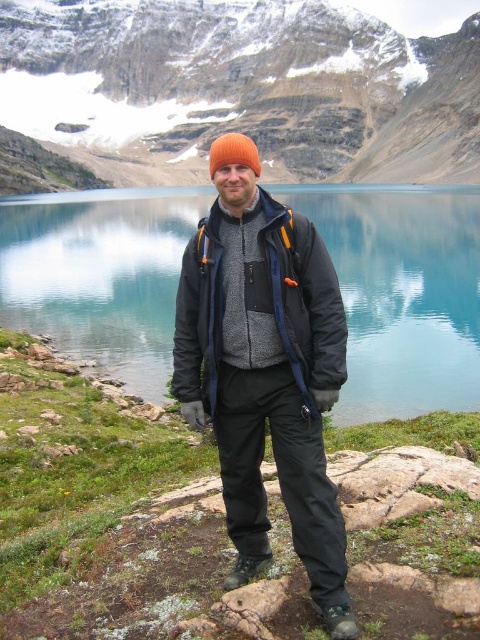
You are a hiker trying to identify your friend who is wearing two jackets. You see a matte black jacket at center and a brushed wool jacket at center. Which jacket is positioned to the right?

The matte black jacket at center is to the right of the brushed wool jacket at center.

Consider the image. You are a hiker trying to identify your jacket from a distance. You notice two jackets at the center of the scene. Which one is closer to you, the matte black jacket at center or the brushed wool jacket at center?

The matte black jacket at center is closer to the viewer than the brushed wool jacket at center.

You are a hiker planning to take a photo of the snowy rock mountain at upper center and the matte black jacket at center. To ensure both are in frame, should you adjust your camera to a wider angle or a narrower angle?

The snowy rock mountain at upper center is positioned on the left side of matte black jacket at center, so adjusting the camera to a wider angle would allow both to be captured in the same frame.